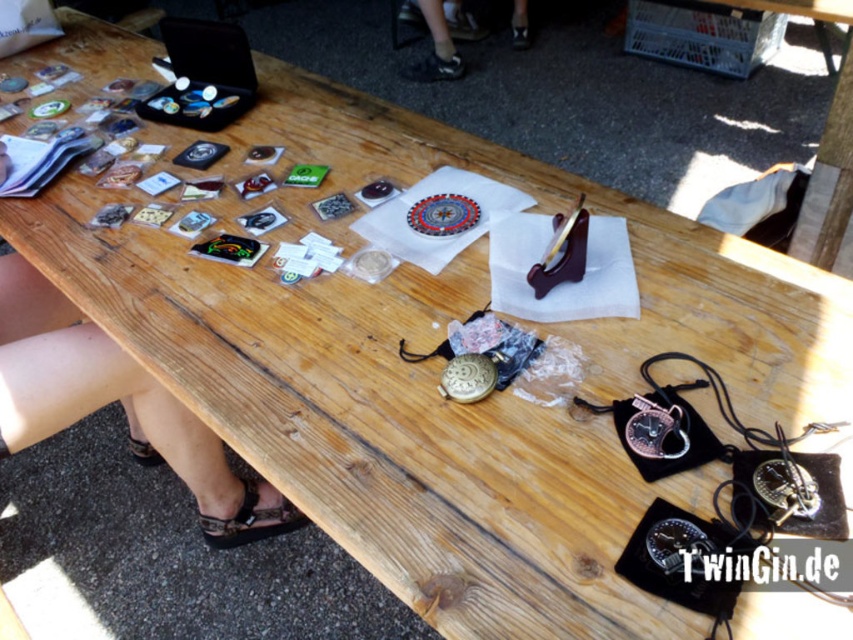
Question: Which point appears closest to the camera in this image?

Choices:
 (A) [x=486, y=372]
 (B) [x=650, y=444]

Answer: (B)

Question: Can you confirm if polished silver pocket watch at lower right is positioned to the left of gold metallic pocket watch at center?

Choices:
 (A) no
 (B) yes

Answer: (A)

Question: Is the position of polished silver pocket watch at lower right more distant than that of gold metallic pocket watch at center?

Choices:
 (A) no
 (B) yes

Answer: (A)

Question: Among these objects, which one is farthest from the camera?

Choices:
 (A) gold metallic pocket watch at center
 (B) polished silver pocket watch at lower right

Answer: (A)

Question: Can you confirm if polished silver pocket watch at lower right is smaller than gold metallic pocket watch at center?

Choices:
 (A) no
 (B) yes

Answer: (A)